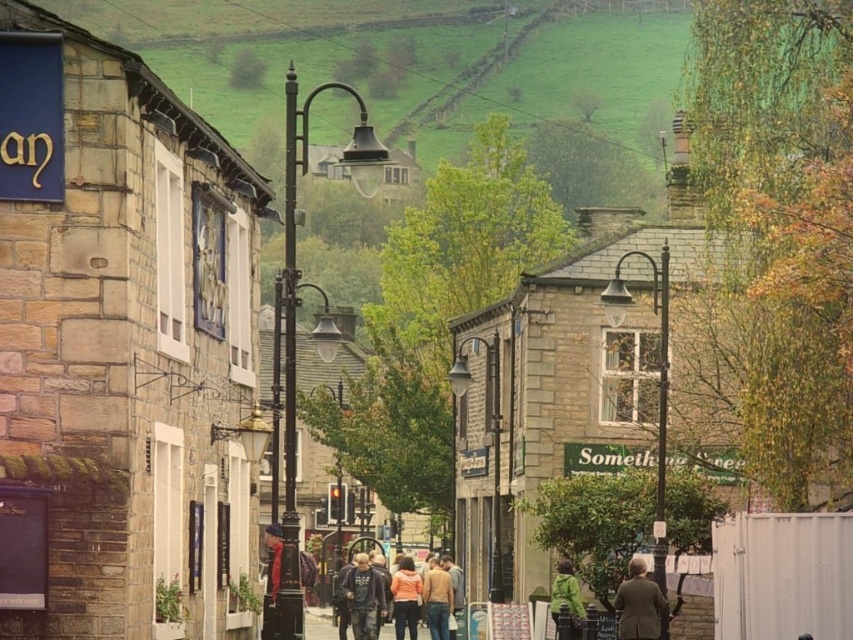
Does dark blue hoodie at center appear on the right side of light brown sweater at center?

Incorrect, dark blue hoodie at center is not on the right side of light brown sweater at center.

Between point (370, 572) and point (422, 600), which one is positioned behind?

The point (422, 600) is more distant.

Who is more forward, [375,576] or [430,598]?

Point [375,576] is more forward.

I want to click on dark blue hoodie at center, so click(363, 596).

Who is more forward, (x=346, y=582) or (x=567, y=636)?

Point (x=567, y=636)

Between dark blue hoodie at center and green matte jacket at lower center, which one is positioned higher?

green matte jacket at lower center is higher up.

What do you see at coordinates (363, 596) in the screenshot? The width and height of the screenshot is (853, 640). I see `dark blue hoodie at center` at bounding box center [363, 596].

This screenshot has height=640, width=853. Identify the location of dark blue hoodie at center. (363, 596).

Is stone building at left taller than dark blue hoodie at center?

Correct, stone building at left is much taller as dark blue hoodie at center.

Is stone building at left thinner than dark blue hoodie at center?

No.

The height and width of the screenshot is (640, 853). Identify the location of stone building at left. (120, 348).